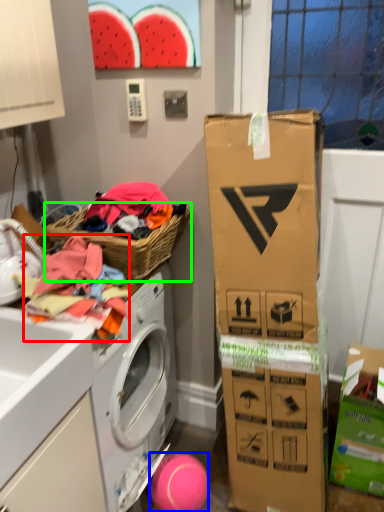
Question: Estimate the real-world distances between objects in this image. Which object is closer to clothing (highlighted by a red box), ball (highlighted by a blue box) or picnic basket (highlighted by a green box)?

Choices:
 (A) ball
 (B) picnic basket

Answer: (B)